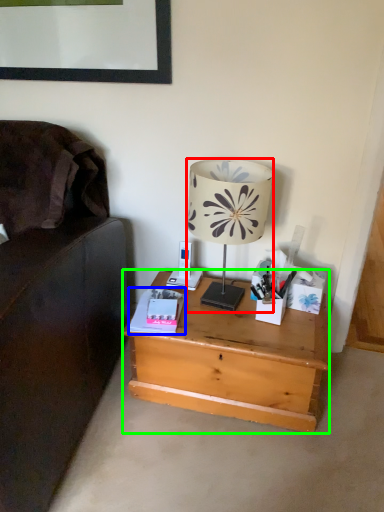
Question: Which object is the closest to the lamp (highlighted by a red box)? Choose among these: paperback book (highlighted by a blue box) or desk (highlighted by a green box).

Choices:
 (A) paperback book
 (B) desk

Answer: (A)